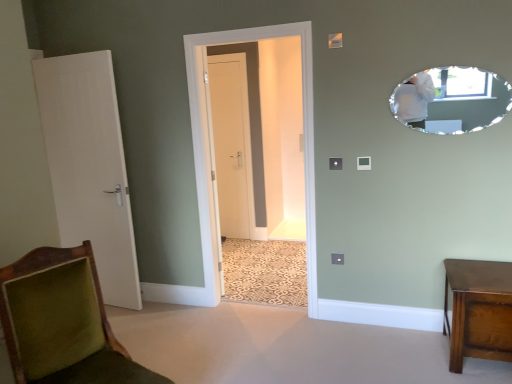
Question: From a real-world perspective, is white wood door at left, the 2th door in the back-to-front sequence, positioned above or below shiny brown wooden side table at lower right?

Choices:
 (A) above
 (B) below

Answer: (A)

Question: From the image's perspective, is white wood door at left, acting as the second door starting from the right, positioned above or below shiny brown wooden side table at lower right?

Choices:
 (A) below
 (B) above

Answer: (B)

Question: Estimate the real-world distances between objects in this image. Which object is farther from the oval-shaped mirror at upper right?

Choices:
 (A) white wood door at left, which is the first door in front-to-back order
 (B) shiny brown wooden side table at lower right
 (C) white matte door at center, the 1th door when ordered from right to left
 (D) velvet green chair at lower left
 (E) clear glass door at center

Answer: (C)

Question: Based on their relative distances, which object is nearer to the white matte door at center, placed as the second door when sorted from left to right?

Choices:
 (A) clear glass door at center
 (B) velvet green chair at lower left
 (C) oval-shaped mirror at upper right
 (D) white wood door at left, which appears as the first door when viewed from the left
 (E) shiny brown wooden side table at lower right

Answer: (A)